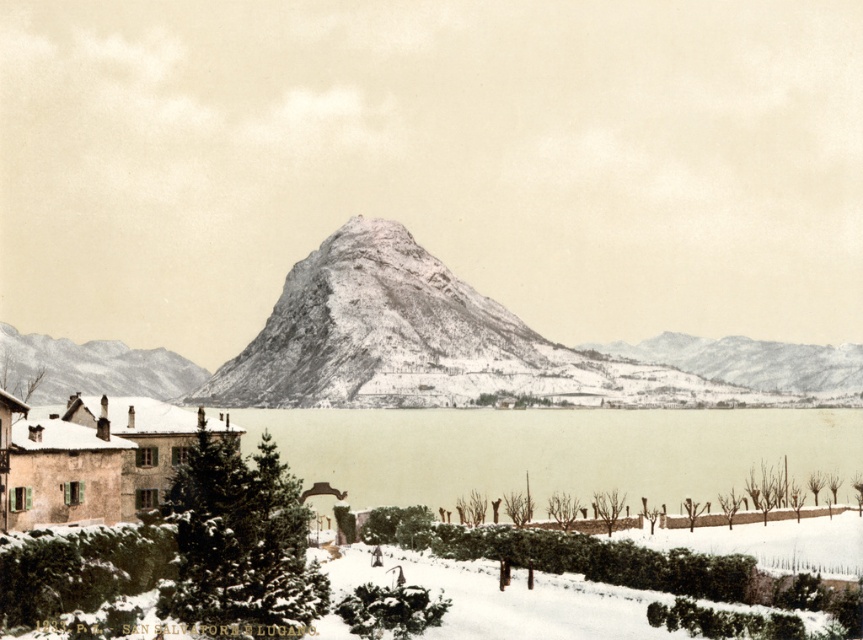
Image resolution: width=863 pixels, height=640 pixels. I want to click on gray textured mountain at center, so click(754, 364).

The height and width of the screenshot is (640, 863). Describe the element at coordinates (754, 364) in the screenshot. I see `gray textured mountain at center` at that location.

Identify the location of gray textured mountain at center. (754, 364).